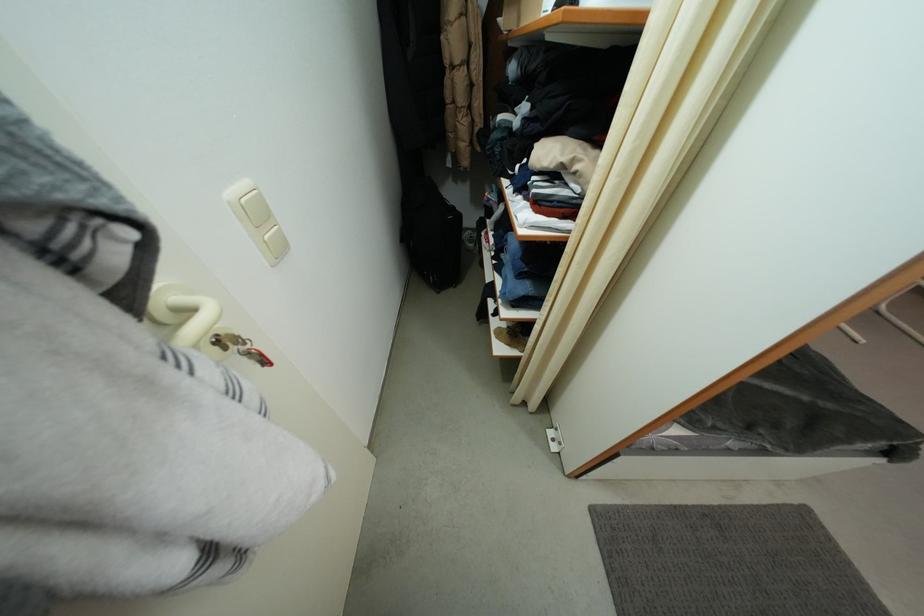
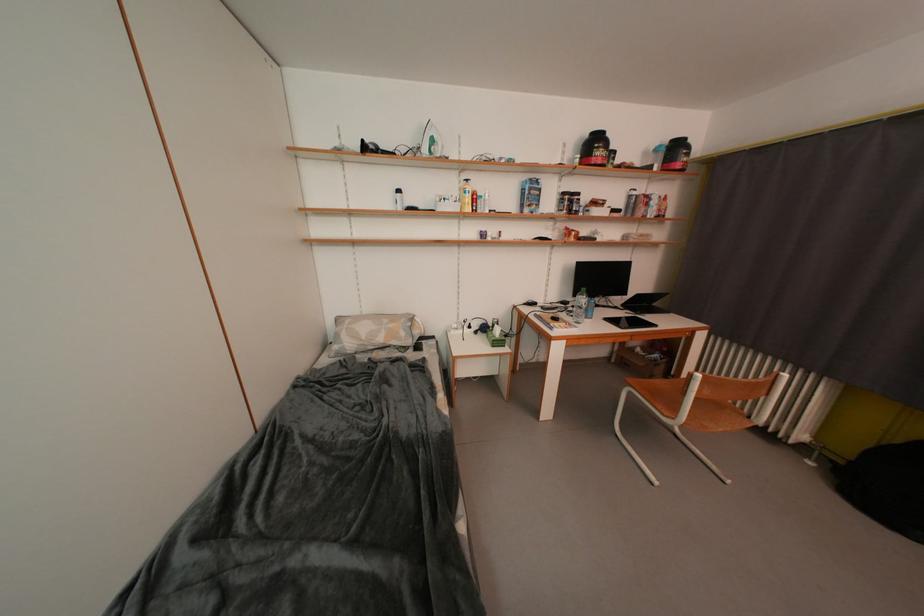
Question: What movement of the cameraman would produce the second image?

Choices:
 (A) Left
 (B) Right
 (C) Forward
 (D) Backward

Answer: (B)